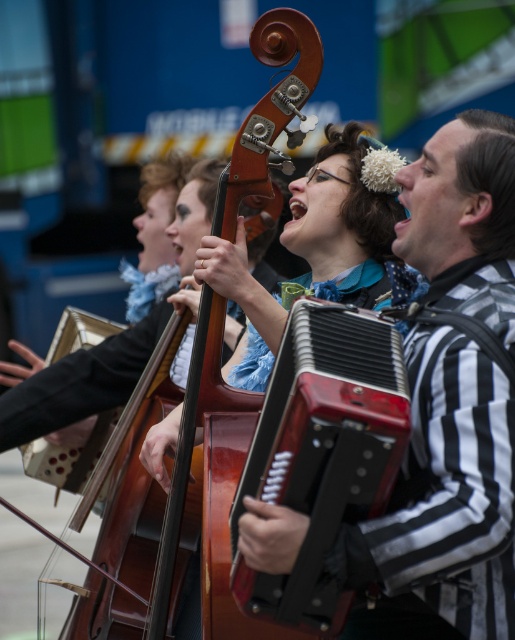
You are a photographer trying to capture a closeup of both the red leather accordion at center and the matte brown cello at center. Based on their positions, which one should you focus on first to ensure both are in the frame?

The red leather accordion at center is positioned on the left side of the matte brown cello at center, so you should focus on the red leather accordion at center first to ensure both are in the frame.

You are a photographer trying to capture a clear shot of both the red leather accordion at center and the wooden violin at center. Since you can only focus on one object at a time, which one should you focus on to ensure the other is still in the background?

You should focus on the red leather accordion at center because it is in front of the wooden violin at center, so the wooden violin will naturally appear in the background when the accordion is in focus.